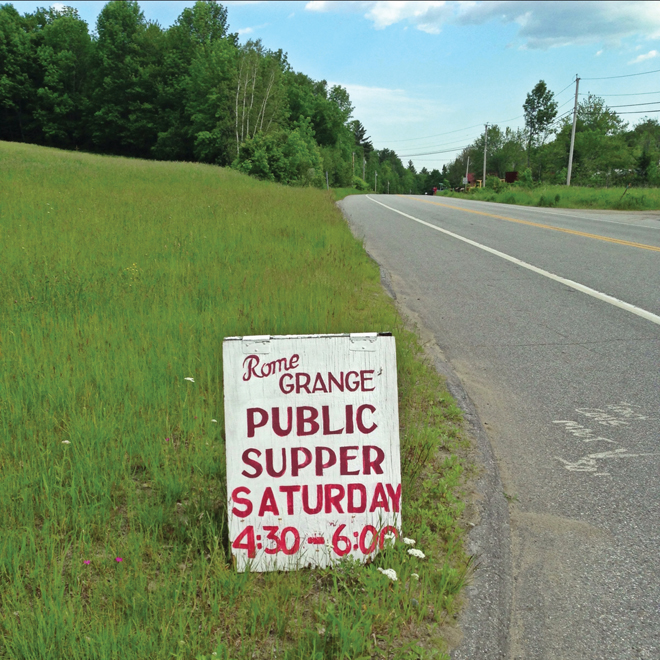
This screenshot has height=660, width=660. In order to click on phones line cords in this screenshot , I will do `click(643, 73)`, `click(626, 94)`, `click(645, 106)`, `click(655, 110)`, `click(459, 127)`, `click(455, 142)`, `click(447, 150)`, `click(441, 160)`.